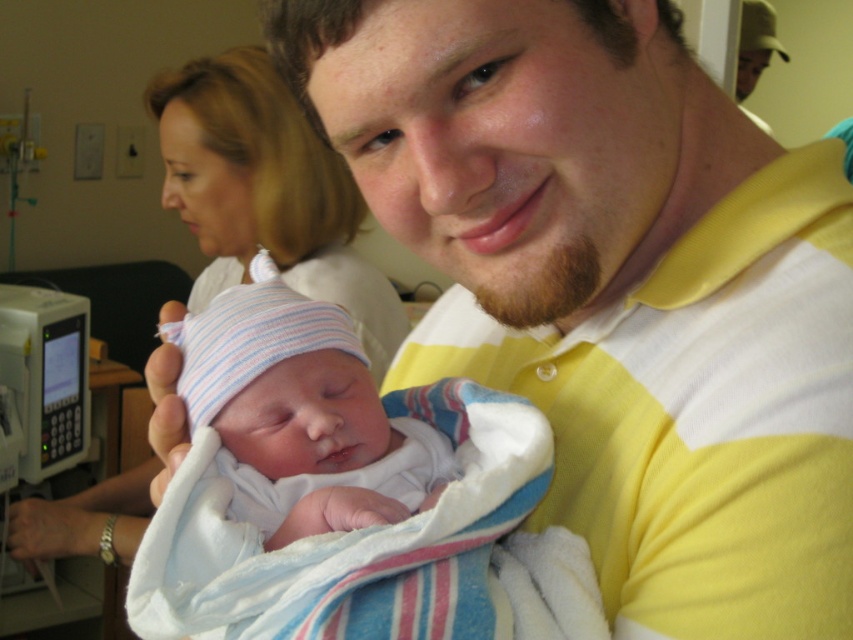
In the hospital room scene, there is a man wearing a yellow striped polo shirt at center and a woman in a smooth white shirt at upper left. From the perspective of someone standing at the entrance of the room, which clothing item is positioned lower?

The yellow striped polo shirt at center is positioned lower than the smooth white shirt at upper left, so the yellow striped polo shirt at center is the one that is lower.

In the hospital room scene, there is a smooth white shirt at upper left and a striped knit hat at center. Which object is positioned to the left of the other?

The smooth white shirt at upper left is positioned to the left of the striped knit hat at center.

In the hospital room scene, the man is wearing a yellow striped polo shirt at center and the newborn baby has a striped knit hat at center. Based on their positions, which clothing item is located to the right side of the other?

The yellow striped polo shirt at center is to the right of the striped knit hat at center.